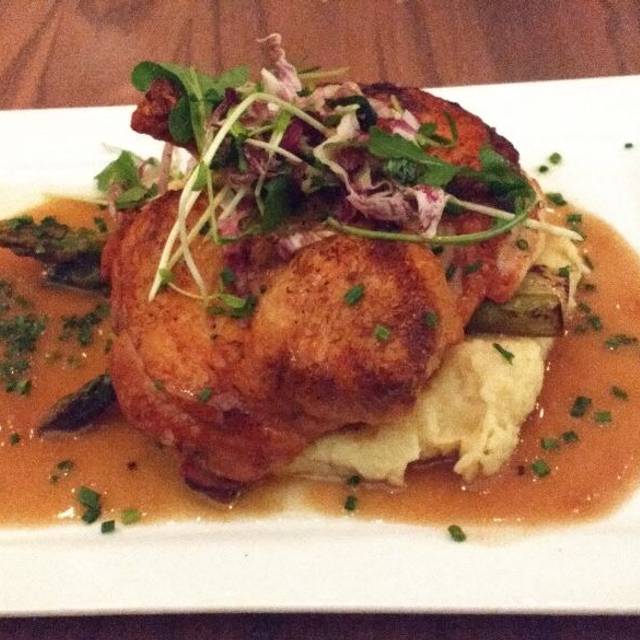
Locate an element on the screen. This screenshot has height=640, width=640. white plate is located at coordinates (612, 146), (584, 134).